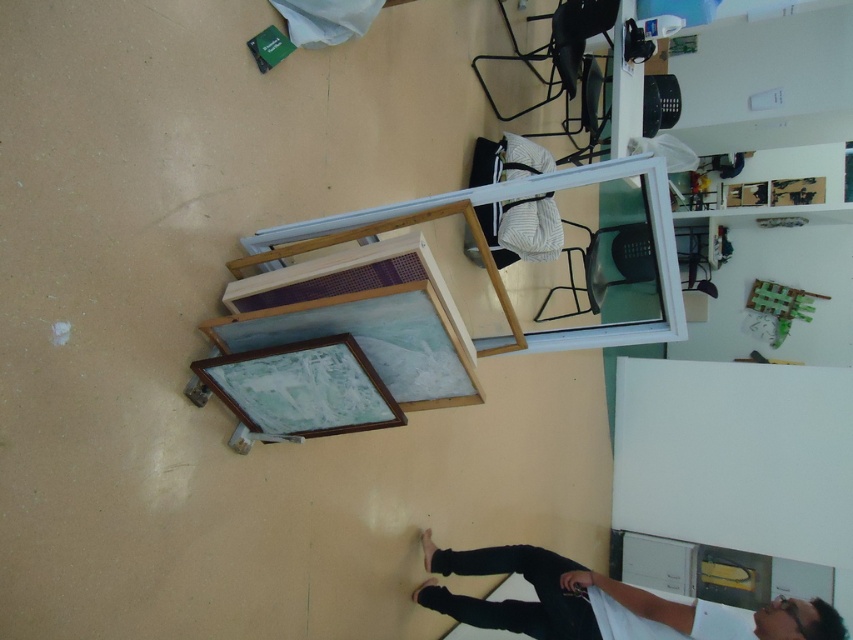
Question: Can you confirm if wooden picture frame at lower center is bigger than wooden picture frame at center?

Choices:
 (A) yes
 (B) no

Answer: (B)

Question: Where is wooden frame at lower center located in relation to wooden picture frame at lower center in the image?

Choices:
 (A) above
 (B) below

Answer: (A)

Question: Which point appears closest to the camera in this image?

Choices:
 (A) coord(405,308)
 (B) coord(566,580)

Answer: (A)

Question: Which point is closer to the camera taking this photo?

Choices:
 (A) (517, 324)
 (B) (387, 340)

Answer: (B)

Question: Does white matte shirt at lower right come behind wooden picture frame at lower center?

Choices:
 (A) yes
 (B) no

Answer: (A)

Question: Considering the real-world distances, which object is farthest from the wooden frame at lower center?

Choices:
 (A) wooden picture frame at lower center
 (B) white matte shirt at lower right

Answer: (B)